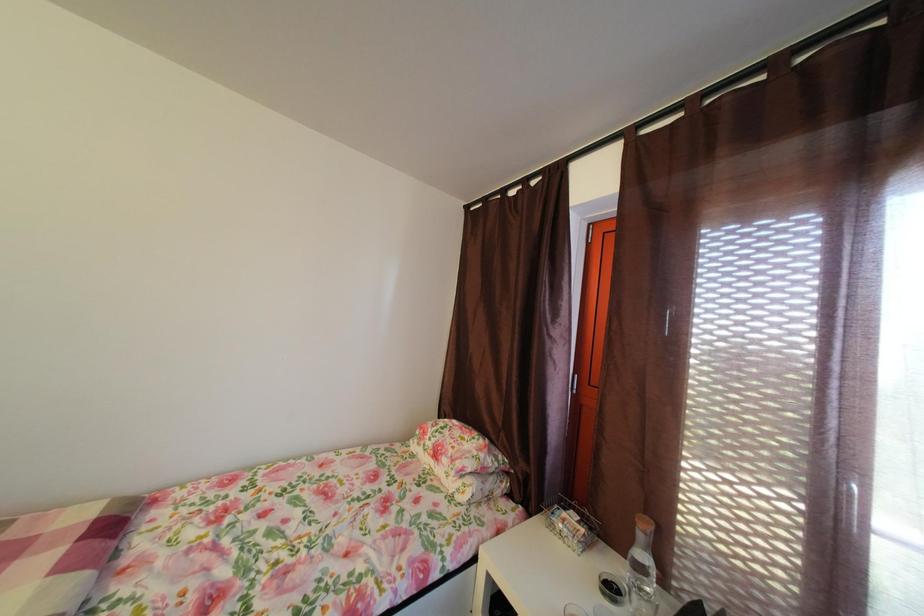
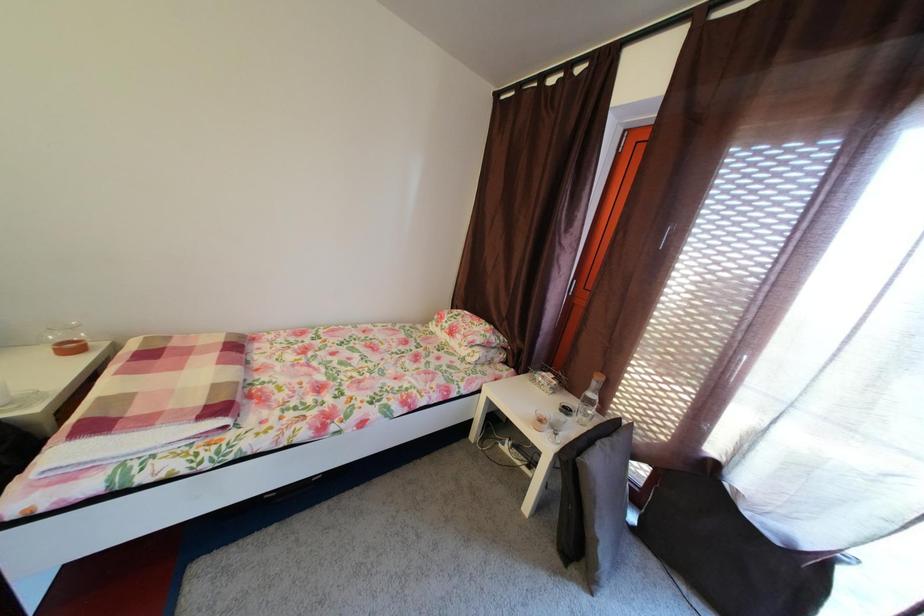
Question: The images are taken continuously from a first-person perspective. In which direction is your viewpoint rotating?

Choices:
 (A) Left
 (B) Right
 (C) Up
 (D) Down

Answer: (D)